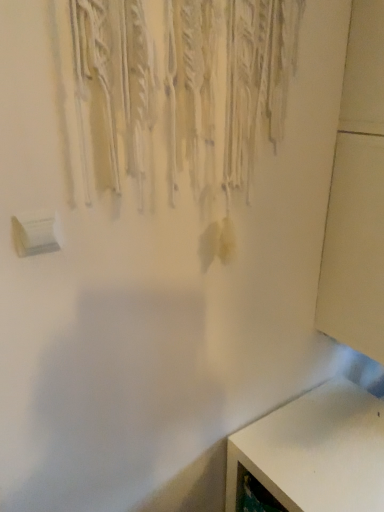
This screenshot has height=512, width=384. Find the location of `vacant region above white glossy cabinet at lower right (from a real-world perspective)`. vacant region above white glossy cabinet at lower right (from a real-world perspective) is located at coordinates (327, 443).